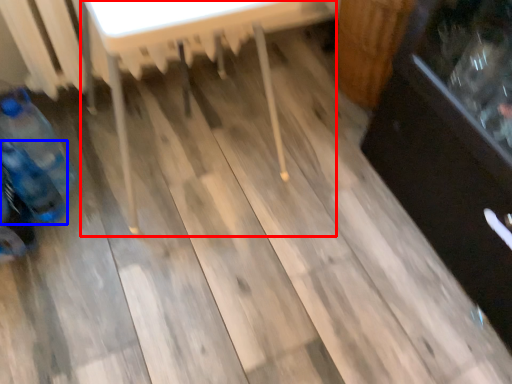
Question: Which object appears closest to the camera in this image, table (highlighted by a red box) or bottle (highlighted by a blue box)?

Choices:
 (A) table
 (B) bottle

Answer: (A)